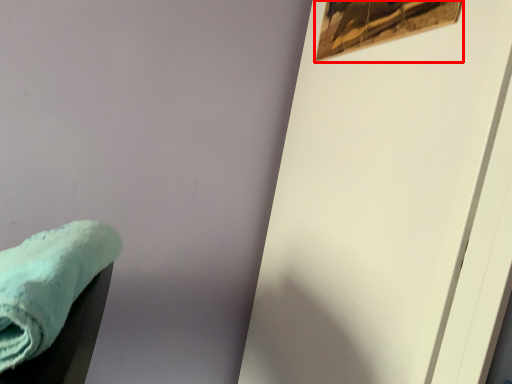
Question: Where is picture frame (annotated by the red box) located in relation to towel in the image?

Choices:
 (A) left
 (B) right

Answer: (B)